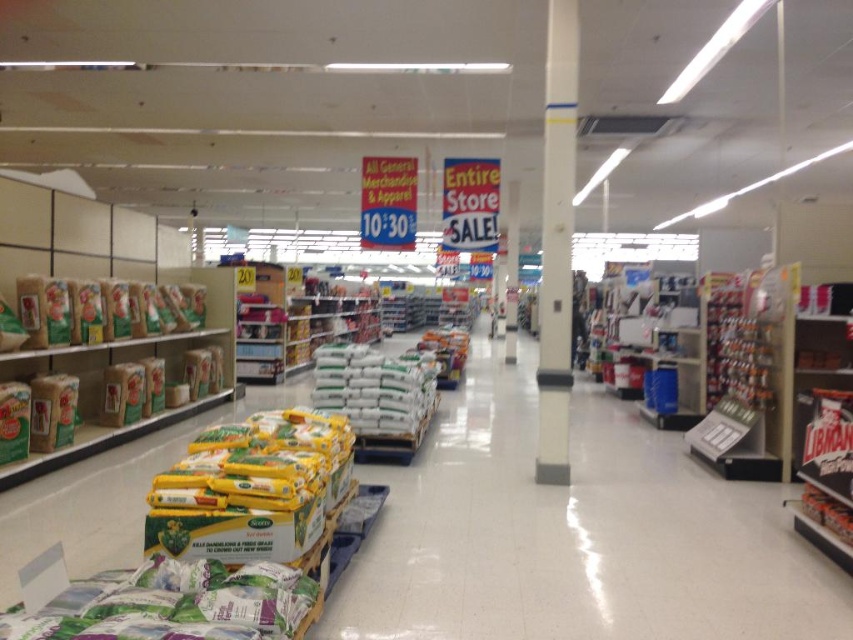
Question: Can you confirm if white plastic bags at center is bigger than matte brown bag at left?

Choices:
 (A) no
 (B) yes

Answer: (B)

Question: Does white glossy pillar at center appear over white matte bag at center?

Choices:
 (A) yes
 (B) no

Answer: (A)

Question: Which of these objects is positioned farthest from the white matte bag at center?

Choices:
 (A) white glossy pillar at center
 (B) yellow-green plastic bags at center
 (C) green matte bag at lower left
 (D) white plastic bags at center

Answer: (C)

Question: Which object is the farthest from the yellow-green plastic bags at center?

Choices:
 (A) matte brown bag at left
 (B) white matte bag at center

Answer: (B)

Question: Among these points, which one is nearest to the camera?

Choices:
 (A) (x=549, y=17)
 (B) (x=16, y=337)
 (C) (x=440, y=353)
 (D) (x=428, y=410)

Answer: (B)

Question: Observing the image, what is the correct spatial positioning of yellow-green plastic bags at center in reference to white glossy pillar at center?

Choices:
 (A) above
 (B) below

Answer: (B)